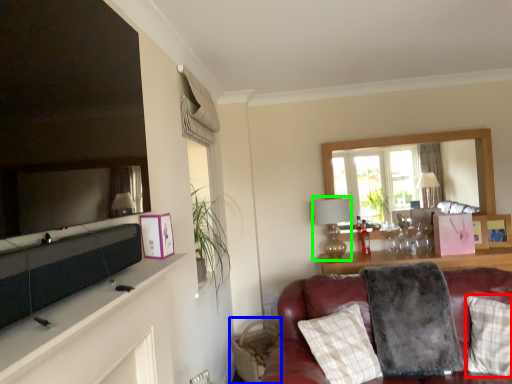
Question: Which object is positioned farthest from pillow (highlighted by a red box)? Select from swivel chair (highlighted by a blue box) and lamp (highlighted by a green box).

Choices:
 (A) swivel chair
 (B) lamp

Answer: (A)